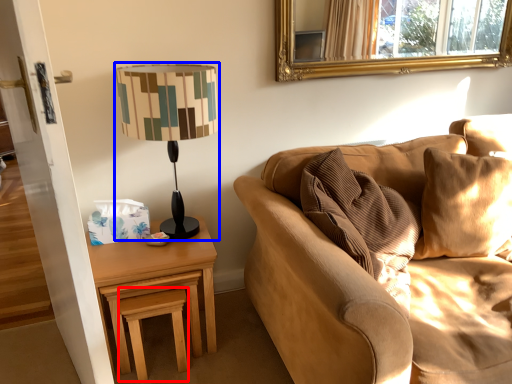
Question: Which object appears closest to the camera in this image, stool (highlighted by a red box) or lamp (highlighted by a blue box)?

Choices:
 (A) stool
 (B) lamp

Answer: (B)